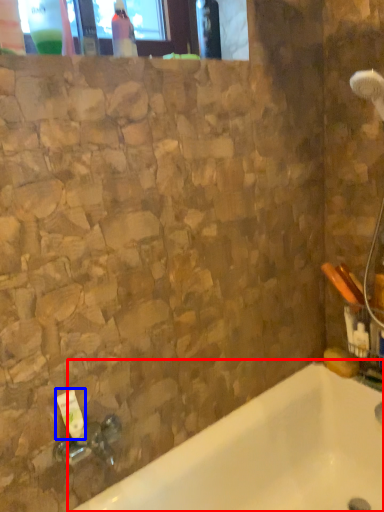
Question: Among these objects, which one is farthest to the camera, bathtub (highlighted by a red box) or toiletry (highlighted by a blue box)?

Choices:
 (A) bathtub
 (B) toiletry

Answer: (B)